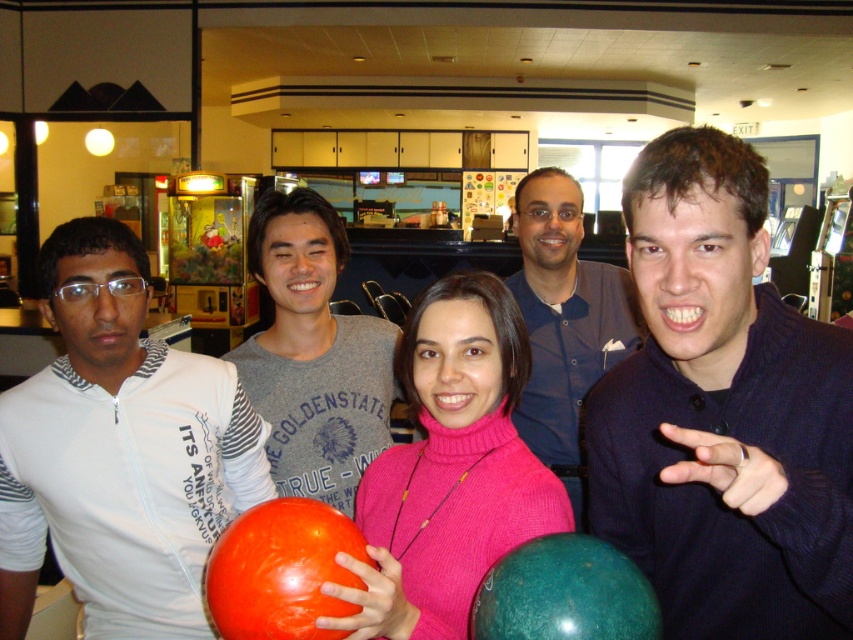
You are a photographer standing 1.5 meters away from the camera. You want to take a photo of the white striped shirt at left. Can you reach the camera to adjust it without moving your position?

The white striped shirt at left and camera are 1.33 meters apart from each other. Since you are already 1.5 meters away from the camera, you are within reach to adjust it without moving.

You are standing at the center of the image and want to find the white striped shirt at left. In which direction should you look to see it?

The white striped shirt at left is located at point 0.706 on the x axis and 0.141 on the y axis. Since you are at the center, you should look to the left and slightly down to see it.